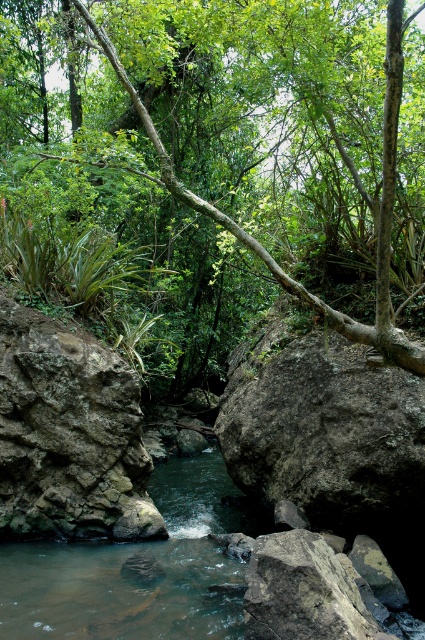
Question: Estimate the real-world distances between objects in this image. Which object is closer to the brown/rocky river at center?

Choices:
 (A) rough textured rock at center
 (B) green leafy tree at center

Answer: (A)

Question: From the image, what is the correct spatial relationship of green leafy tree at center in relation to rough textured rock at center?

Choices:
 (A) right
 (B) left

Answer: (A)

Question: Estimate the real-world distances between objects in this image. Which object is farther from the brown/rocky river at center?

Choices:
 (A) green leafy tree at center
 (B) rough textured rock at center

Answer: (A)

Question: Is green leafy tree at center further to camera compared to brown/rocky river at center?

Choices:
 (A) yes
 (B) no

Answer: (B)

Question: Can you confirm if rough textured rock at center is positioned to the left of brown/rocky river at center?

Choices:
 (A) no
 (B) yes

Answer: (B)

Question: Which object is positioned farthest from the green leafy tree at center?

Choices:
 (A) brown/rocky river at center
 (B) rough textured rock at center

Answer: (A)